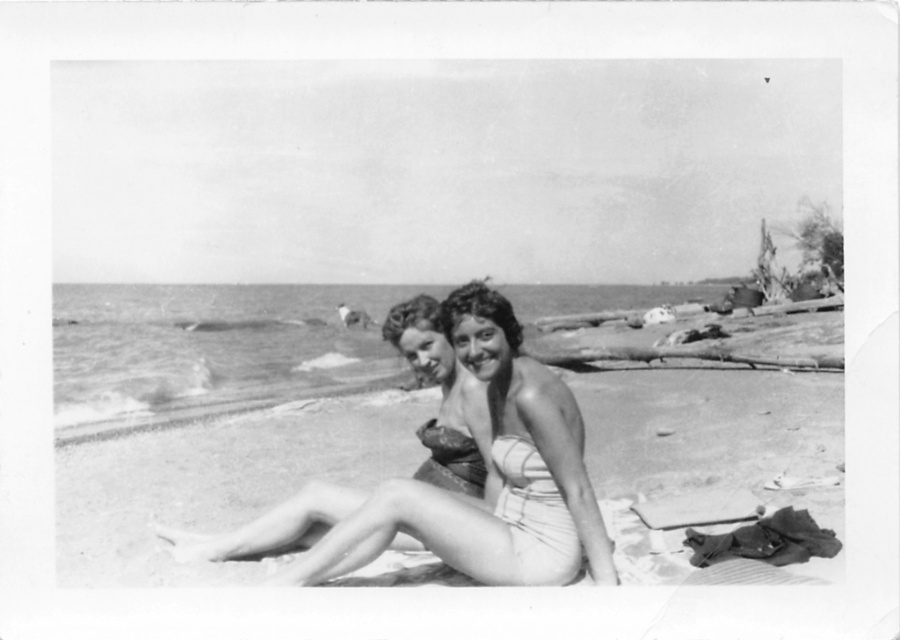
Based on the scene described, which object among the matte swimsuit at center and the matte fabric bikini top at center is bigger in size?

The matte swimsuit at center is bigger in size compared to the matte fabric bikini top at center.

You are a photographer who wants to capture a closeup shot of both the smooth skin bikini at center and the matte fabric bikini top at center in the image. Based on their sizes, which one would require you to move closer to get a clear focus?

Answer: The smooth skin bikini at center is much taller than the matte fabric bikini top at center, so you would need to move closer to the matte fabric bikini top at center to capture it clearly in the closeup shot.